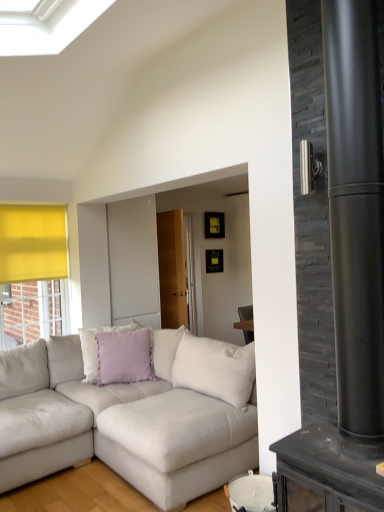
The width and height of the screenshot is (384, 512). What do you see at coordinates (125, 356) in the screenshot? I see `lavender fabric pillow at center` at bounding box center [125, 356].

You are a GUI agent. You are given a task and a screenshot of the screen. Output one action in this format:
    pyautogui.click(x=<x>, y=<y>)
    Task: Click on the light gray fabric couch at lower left
    
    Given the screenshot: What is the action you would take?
    pyautogui.click(x=119, y=424)

Where is `lavender fabric pillow at center`? lavender fabric pillow at center is located at coordinates (125, 356).

Can matte black fireplace at right be found inside light gray fabric couch at lower left?

Actually, matte black fireplace at right is outside light gray fabric couch at lower left.

Does light gray fabric couch at lower left turn towards matte black fireplace at right?

Yes, light gray fabric couch at lower left is aimed at matte black fireplace at right.

Considering the sizes of light gray fabric couch at lower left and matte black fireplace at right in the image, is light gray fabric couch at lower left bigger or smaller than matte black fireplace at right?

Considering their sizes, light gray fabric couch at lower left takes up more space than matte black fireplace at right.

Can you tell me how much light gray fabric couch at lower left and matte black fireplace at right differ in facing direction?

89 degrees.

Where is `fireplace in front of the light gray fabric couch at lower left`? fireplace in front of the light gray fabric couch at lower left is located at coordinates (350, 272).

From the image's perspective, which is below, matte black fireplace at right or light gray fabric couch at lower left?

light gray fabric couch at lower left appears lower in the image.

Which of these two, matte black fireplace at right or light gray fabric couch at lower left, stands shorter?

Standing shorter between the two is light gray fabric couch at lower left.

How many degrees apart are the facing directions of matte black fireplace at right and light gray fabric couch at lower left?

The facing directions of matte black fireplace at right and light gray fabric couch at lower left are 89 degrees apart.

Considering the sizes of objects matte black fireplace at right and lavender fabric pillow at center in the image provided, who is wider, matte black fireplace at right or lavender fabric pillow at center?

Wider between the two is matte black fireplace at right.

From the picture: Is matte black fireplace at right to the left of lavender fabric pillow at center from the viewer's perspective?

No, matte black fireplace at right is not to the left of lavender fabric pillow at center.

From the picture: Is the position of matte black fireplace at right less distant than that of lavender fabric pillow at center?

Yes.

From a real-world perspective, is matte black fireplace at right above or below lavender fabric pillow at center?

In terms of real-world spatial position, matte black fireplace at right is above lavender fabric pillow at center.

Considering the positions of point (171, 420) and point (141, 355), is point (171, 420) closer or farther from the camera than point (141, 355)?

Point (171, 420) is closer to the camera than point (141, 355).

Can you confirm if light gray fabric couch at lower left is taller than lavender fabric pillow at center?

Yes.

Locate an element on the screen. studio couch to the left of lavender fabric pillow at center is located at coordinates (119, 424).

Is light gray fabric couch at lower left inside the boundaries of lavender fabric pillow at center, or outside?

light gray fabric couch at lower left cannot be found inside lavender fabric pillow at center.

From the picture: Considering the relative sizes of lavender fabric pillow at center and matte black fireplace at right in the image provided, is lavender fabric pillow at center shorter than matte black fireplace at right?

Yes, lavender fabric pillow at center is shorter than matte black fireplace at right.

Looking at this image, is lavender fabric pillow at center thinner than matte black fireplace at right?

Correct, the width of lavender fabric pillow at center is less than that of matte black fireplace at right.

Considering the sizes of objects lavender fabric pillow at center and matte black fireplace at right in the image provided, who is smaller, lavender fabric pillow at center or matte black fireplace at right?

lavender fabric pillow at center is smaller.

Image resolution: width=384 pixels, height=512 pixels. What are the coordinates of `pillow on the left of the matte black fireplace at right` in the screenshot? It's located at (125, 356).

From the picture: In terms of height, does lavender fabric pillow at center look taller or shorter compared to light gray fabric couch at lower left?

lavender fabric pillow at center is shorter than light gray fabric couch at lower left.

Is lavender fabric pillow at center completely or partially outside of light gray fabric couch at lower left?

No, lavender fabric pillow at center is inside light gray fabric couch at lower left's boundary.

At what (x,y) coordinates should I click in order to perform the action: click on pillow behind the light gray fabric couch at lower left. Please return your answer as a coordinate pair (x, y). This screenshot has height=512, width=384. Looking at the image, I should click on (125, 356).

Is lavender fabric pillow at center oriented towards light gray fabric couch at lower left?

Yes, lavender fabric pillow at center is facing light gray fabric couch at lower left.

The height and width of the screenshot is (512, 384). Identify the location of fireplace in front of the light gray fabric couch at lower left. (350, 272).

This screenshot has width=384, height=512. In order to click on studio couch below the matte black fireplace at right (from a real-world perspective) in this screenshot , I will do 119,424.

From the image, which object appears to be farther from lavender fabric pillow at center, matte black fireplace at right or light gray fabric couch at lower left?

The object further to lavender fabric pillow at center is matte black fireplace at right.

From the image, which object appears to be farther from light gray fabric couch at lower left, matte black fireplace at right or lavender fabric pillow at center?

matte black fireplace at right is positioned further to the anchor light gray fabric couch at lower left.

Based on the photo, from the image, which object appears to be farther from matte black fireplace at right, lavender fabric pillow at center or light gray fabric couch at lower left?

lavender fabric pillow at center lies further to matte black fireplace at right than the other object.

From the image, which object appears to be nearer to matte black fireplace at right, light gray fabric couch at lower left or lavender fabric pillow at center?

light gray fabric couch at lower left is positioned closer to the anchor matte black fireplace at right.

Based on their spatial positions, is lavender fabric pillow at center or matte black fireplace at right further from light gray fabric couch at lower left?

matte black fireplace at right is further to light gray fabric couch at lower left.

Looking at the image, which one is located closer to lavender fabric pillow at center, light gray fabric couch at lower left or matte black fireplace at right?

light gray fabric couch at lower left.

The height and width of the screenshot is (512, 384). I want to click on studio couch between matte black fireplace at right and lavender fabric pillow at center in the front-back direction, so point(119,424).